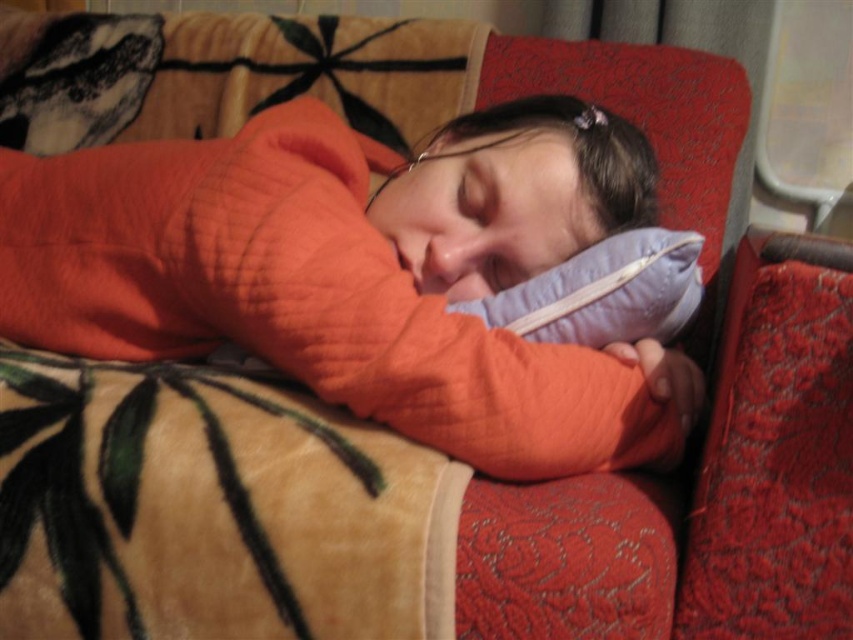
Question: Where is orange quilted sweater at center located in relation to purple fabric pillow at center in the image?

Choices:
 (A) below
 (B) above

Answer: (B)

Question: Which point appears farthest from the camera in this image?

Choices:
 (A) (682, 323)
 (B) (364, 406)

Answer: (A)

Question: Can you confirm if orange quilted sweater at center is bigger than purple fabric pillow at center?

Choices:
 (A) no
 (B) yes

Answer: (B)

Question: Which object appears closest to the camera in this image?

Choices:
 (A) purple fabric pillow at center
 (B) orange quilted sweater at center

Answer: (B)

Question: Can you confirm if orange quilted sweater at center is positioned to the right of purple fabric pillow at center?

Choices:
 (A) yes
 (B) no

Answer: (B)